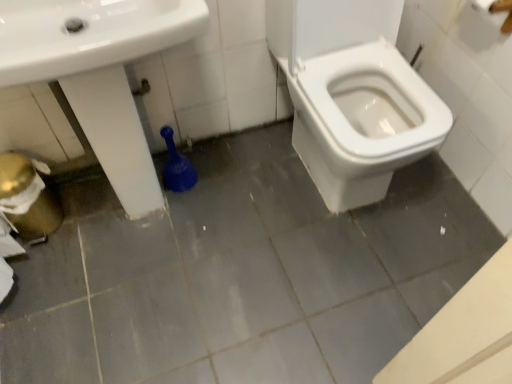
Question: Looking at their shapes, would you say white glossy sink at lower left is wider or thinner than white glossy toilet at center?

Choices:
 (A) thin
 (B) wide

Answer: (A)

Question: Considering the positions of white glossy sink at lower left and white glossy toilet at center in the image, is white glossy sink at lower left taller or shorter than white glossy toilet at center?

Choices:
 (A) short
 (B) tall

Answer: (B)

Question: Considering the positions of white glossy sink at lower left and white glossy toilet at center in the image, is white glossy sink at lower left bigger or smaller than white glossy toilet at center?

Choices:
 (A) big
 (B) small

Answer: (A)

Question: From the image's perspective, is white glossy toilet at center located above or below white glossy sink at lower left?

Choices:
 (A) below
 (B) above

Answer: (B)

Question: From a real-world perspective, is white glossy toilet at center above or below white glossy sink at lower left?

Choices:
 (A) below
 (B) above

Answer: (A)

Question: Considering the positions of white glossy toilet at center and white glossy sink at lower left in the image, is white glossy toilet at center bigger or smaller than white glossy sink at lower left?

Choices:
 (A) small
 (B) big

Answer: (A)

Question: Is white glossy toilet at center in front of or behind white glossy sink at lower left in the image?

Choices:
 (A) front
 (B) behind

Answer: (B)